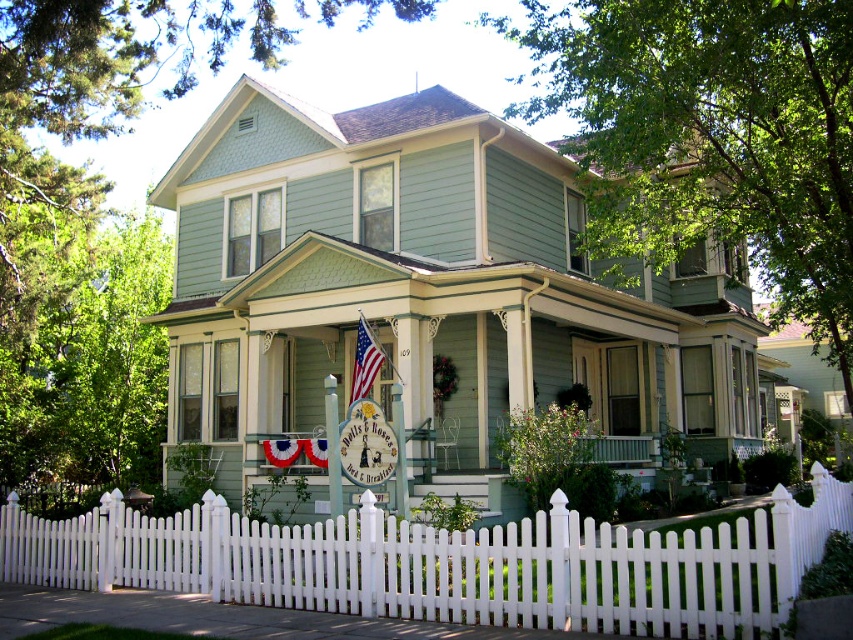
You are standing at the entrance of the house and want to walk towards the white picket fence at lower center. In which direction should you move?

You should move towards the lower center direction to reach the white picket fence at lower center.

You are a visitor approaching the house and want to know if the white picket fence at lower center is taller than the american flag at center. Can you confirm this based on the scene?

The white picket fence at lower center is taller than the american flag at center according to the description.